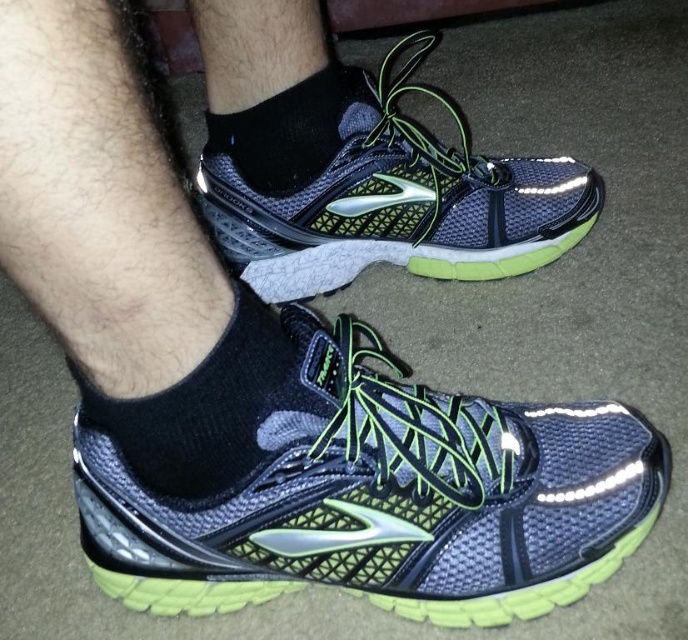
Based on the photo, you are trying to put on your shoes and socks. You have a matte mesh shoe at center and a black mesh sock at lower center. Which one should you put on first according to their sizes?

The black mesh sock at lower center should be put on first because it is narrower than the matte mesh shoe at center, following the usual order of sock before shoe.

You are standing in a store looking at two pairs of shoes displayed on a shelf. You see the matte mesh shoe at center and the matte mesh running shoe at center. Which one is positioned to the left?

The matte mesh shoe at center is positioned to the left of the matte mesh running shoe at center.

You are a photographer trying to capture the neon green accents on both the matte mesh shoe at center and the matte mesh running shoe at center. Since you want to ensure both shoes are in focus, which one should you adjust your camera focus on first, the one closer to you or the one further away?

The matte mesh shoe at center is located below the matte mesh running shoe at center, so the matte mesh shoe at center is closer to you. To ensure both are in focus, start focusing on the closer one first.